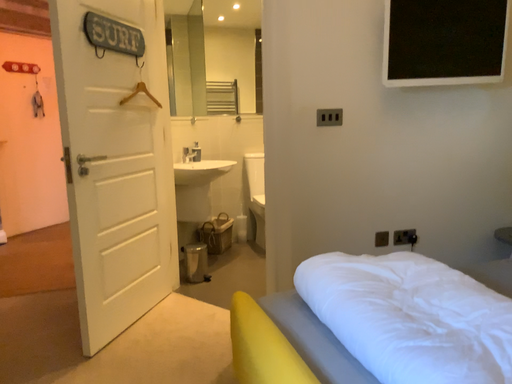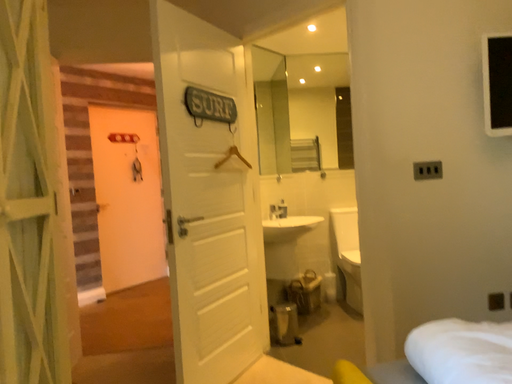
Question: How did the camera likely rotate when shooting the video?

Choices:
 (A) rotated upward
 (B) rotated downward

Answer: (A)